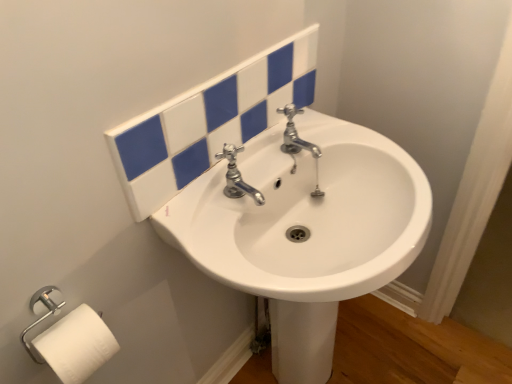
Question: Is white glossy sink at center bigger than white matte toilet paper at lower left?

Choices:
 (A) no
 (B) yes

Answer: (B)

Question: Considering the relative sizes of white glossy sink at center and white matte toilet paper at lower left in the image provided, is white glossy sink at center smaller than white matte toilet paper at lower left?

Choices:
 (A) yes
 (B) no

Answer: (B)

Question: From the image's perspective, is white glossy sink at center under white matte toilet paper at lower left?

Choices:
 (A) no
 (B) yes

Answer: (B)

Question: Is white glossy sink at center aimed at white matte toilet paper at lower left?

Choices:
 (A) yes
 (B) no

Answer: (B)

Question: Considering the relative sizes of white glossy sink at center and white matte toilet paper at lower left in the image provided, is white glossy sink at center thinner than white matte toilet paper at lower left?

Choices:
 (A) no
 (B) yes

Answer: (A)

Question: Is white glossy sink at center positioned in front of white matte toilet paper at lower left?

Choices:
 (A) no
 (B) yes

Answer: (B)

Question: Does white matte toilet paper at lower left have a lesser width compared to polished chrome faucet at center?

Choices:
 (A) no
 (B) yes

Answer: (B)

Question: Is white matte toilet paper at lower left oriented away from polished chrome faucet at center?

Choices:
 (A) yes
 (B) no

Answer: (B)

Question: Does white matte toilet paper at lower left have a smaller size compared to polished chrome faucet at center?

Choices:
 (A) no
 (B) yes

Answer: (A)

Question: Does white matte toilet paper at lower left appear on the right side of polished chrome faucet at center?

Choices:
 (A) yes
 (B) no

Answer: (B)

Question: Is the position of white matte toilet paper at lower left less distant than that of polished chrome faucet at center?

Choices:
 (A) no
 (B) yes

Answer: (B)

Question: Is white matte toilet paper at lower left oriented towards polished chrome faucet at center?

Choices:
 (A) yes
 (B) no

Answer: (B)

Question: Can you confirm if polished chrome faucet at center is bigger than white matte toilet paper at lower left?

Choices:
 (A) yes
 (B) no

Answer: (B)